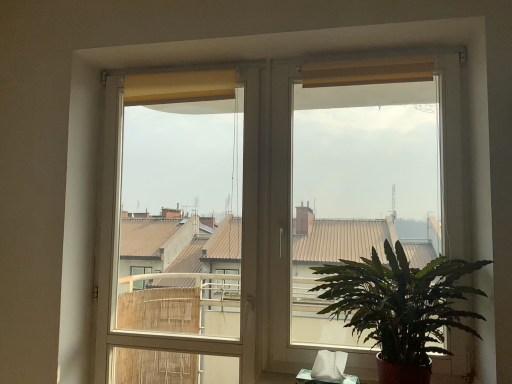
The height and width of the screenshot is (384, 512). Describe the element at coordinates (400, 307) in the screenshot. I see `green leafy plant at lower right` at that location.

The image size is (512, 384). What are the coordinates of `matte yellow screen at right` in the screenshot? It's located at (360, 188).

Looking at this image, relative to white plastic window frame at center, is green leafy plant at lower right in front or behind?

green leafy plant at lower right is positioned closer to the viewer than white plastic window frame at center.

Does green leafy plant at lower right touch white plastic window frame at center?

No, green leafy plant at lower right is not in contact with white plastic window frame at center.

Is white plastic window frame at center a part of green leafy plant at lower right?

Definitely not — white plastic window frame at center is not inside green leafy plant at lower right.

Does point (426, 281) lie behind point (130, 292)?

No.

From the image's perspective, is white plastic window frame at center above or below green leafy plant at lower right?

white plastic window frame at center is situated higher than green leafy plant at lower right in the image.

Considering the positions of objects white plastic window frame at center and green leafy plant at lower right in the image provided, who is more to the right, white plastic window frame at center or green leafy plant at lower right?

From the viewer's perspective, green leafy plant at lower right appears more on the right side.

From a real-world perspective, is matte yellow screen at right physically located above or below white plastic window frame at center?

In terms of real-world spatial position, matte yellow screen at right is above white plastic window frame at center.

Considering the sizes of objects matte yellow screen at right and white plastic window frame at center in the image provided, who is bigger, matte yellow screen at right or white plastic window frame at center?

white plastic window frame at center.

Do you think matte yellow screen at right is within white plastic window frame at center, or outside of it?

matte yellow screen at right is not inside white plastic window frame at center, it's outside.

Is matte yellow screen at right oriented towards white plastic window frame at center?

No, matte yellow screen at right is not aimed at white plastic window frame at center.

Would you say white plastic window frame at center is a long distance from matte yellow screen at right?

Yes.

Which object is positioned more to the right, white plastic window frame at center or matte yellow screen at right?

Positioned to the right is matte yellow screen at right.

From the image's perspective, is white plastic window frame at center located above matte yellow screen at right?

No, from the image's perspective, white plastic window frame at center is not above matte yellow screen at right.

Locate an element on the screen. This screenshot has width=512, height=384. window screen on the left side of green leafy plant at lower right is located at coordinates (360, 188).

From a real-world perspective, who is located higher, green leafy plant at lower right or matte yellow screen at right?

In real-world perspective, matte yellow screen at right is above.

Which of these two, green leafy plant at lower right or matte yellow screen at right, stands shorter?

With less height is green leafy plant at lower right.

Is green leafy plant at lower right smaller than matte yellow screen at right?

No.

Would you say green leafy plant at lower right is part of matte yellow screen at right's contents?

No, matte yellow screen at right does not contain green leafy plant at lower right.

Does matte yellow screen at right appear on the left side of green leafy plant at lower right?

Yes, matte yellow screen at right is to the left of green leafy plant at lower right.

Considering the relative sizes of matte yellow screen at right and green leafy plant at lower right in the image provided, is matte yellow screen at right smaller than green leafy plant at lower right?

Yes, matte yellow screen at right is smaller than green leafy plant at lower right.

Image resolution: width=512 pixels, height=384 pixels. In order to click on window frame to the left of green leafy plant at lower right in this screenshot , I will do `click(180, 231)`.

I want to click on houseplant below the white plastic window frame at center (from a real-world perspective), so click(400, 307).

Based on their spatial positions, is green leafy plant at lower right or white plastic window frame at center further from matte yellow screen at right?

white plastic window frame at center.

Considering their positions, is white plastic window frame at center positioned closer to green leafy plant at lower right than matte yellow screen at right?

matte yellow screen at right is positioned closer to the anchor green leafy plant at lower right.

Estimate the real-world distances between objects in this image. Which object is further from white plastic window frame at center, matte yellow screen at right or green leafy plant at lower right?

green leafy plant at lower right is positioned further to the anchor white plastic window frame at center.

From the image, which object appears to be farther from matte yellow screen at right, white plastic window frame at center or green leafy plant at lower right?

white plastic window frame at center is positioned further to the anchor matte yellow screen at right.

Estimate the real-world distances between objects in this image. Which object is closer to white plastic window frame at center, green leafy plant at lower right or matte yellow screen at right?

matte yellow screen at right is closer to white plastic window frame at center.

From the image, which object appears to be farther from green leafy plant at lower right, matte yellow screen at right or white plastic window frame at center?

The object further to green leafy plant at lower right is white plastic window frame at center.

Where is `window screen located between white plastic window frame at center and green leafy plant at lower right in the left-right direction`? Image resolution: width=512 pixels, height=384 pixels. window screen located between white plastic window frame at center and green leafy plant at lower right in the left-right direction is located at coordinates (360, 188).